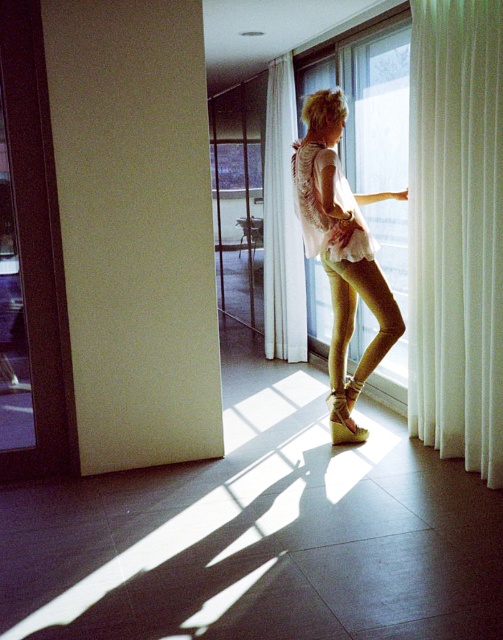
Is transparent glass door at center wider than white sheer curtain at center?

Correct, the width of transparent glass door at center exceeds that of white sheer curtain at center.

Is point (246, 204) behind point (274, 182)?

Yes, point (246, 204) is behind point (274, 182).

Identify the location of transparent glass door at center. Image resolution: width=503 pixels, height=640 pixels. (238, 198).

From the picture: Who is more forward, (336, 237) or (318, 208)?

Point (318, 208) is in front.

Does light beige fabric blouse at center have a greater height compared to white lace dress at center?

Correct, light beige fabric blouse at center is much taller as white lace dress at center.

Which is in front, point (346, 406) or point (298, 179)?

Point (298, 179) is more forward.

Locate an element on the screen. Image resolution: width=503 pixels, height=640 pixels. light beige fabric blouse at center is located at coordinates (342, 253).

Does light beige fabric blouse at center appear over transparent glass door at center?

No.

Where is `light beige fabric blouse at center`? The image size is (503, 640). light beige fabric blouse at center is located at coordinates (342, 253).